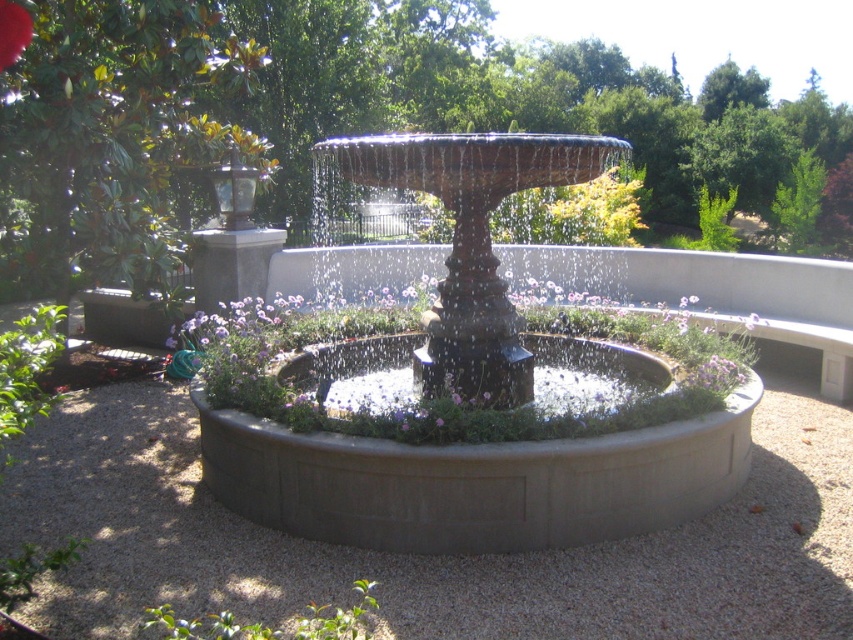
Question: Which is nearer to the red matte flower at center?

Choices:
 (A) dark brown stone fountain at center
 (B) gray gravel at center
 (C) purple matte flower at center

Answer: (A)

Question: Does dark brown stone fountain at center appear over purple matte flower at center?

Choices:
 (A) yes
 (B) no

Answer: (A)

Question: Can you confirm if gray gravel at center is positioned to the right of red matte flower at center?

Choices:
 (A) yes
 (B) no

Answer: (A)

Question: Among these objects, which one is nearest to the camera?

Choices:
 (A) gray gravel at center
 (B) purple matte flower at center
 (C) dark brown stone fountain at center

Answer: (A)

Question: Which object is farther from the camera taking this photo?

Choices:
 (A) gray gravel at center
 (B) red matte flower at center
 (C) purple matte flower at center

Answer: (B)

Question: Does gray gravel at center appear on the right side of purple matte flower at center?

Choices:
 (A) yes
 (B) no

Answer: (B)